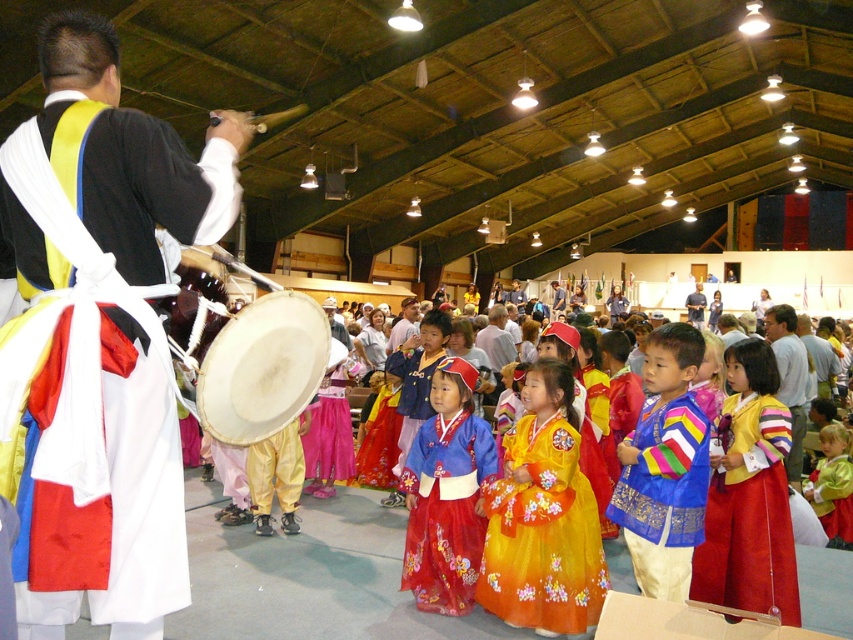
Question: Does blue satin blouse at center have a smaller size compared to blue satin hanbok at center?

Choices:
 (A) no
 (B) yes

Answer: (A)

Question: Can you confirm if blue satin blouse at center is positioned below yellow satin hanbok at center?

Choices:
 (A) yes
 (B) no

Answer: (B)

Question: Which of these objects is positioned closest to the yellow satin hanbok at center?

Choices:
 (A) smooth brown drum at center
 (B) blue denim shirt at center

Answer: (A)

Question: Can you confirm if floral silk dress at center is positioned above blue satin hanbok at center?

Choices:
 (A) no
 (B) yes

Answer: (B)

Question: Among these objects, which one is nearest to the camera?

Choices:
 (A) silky satin robe at left
 (B) white wooden drum at center
 (C) blue satin hanbok at center
 (D) blue satin blouse at center

Answer: (A)

Question: Which point is closer to the camera?

Choices:
 (A) (262, 397)
 (B) (596, 589)
 (C) (689, 320)
 (D) (410, 304)

Answer: (A)